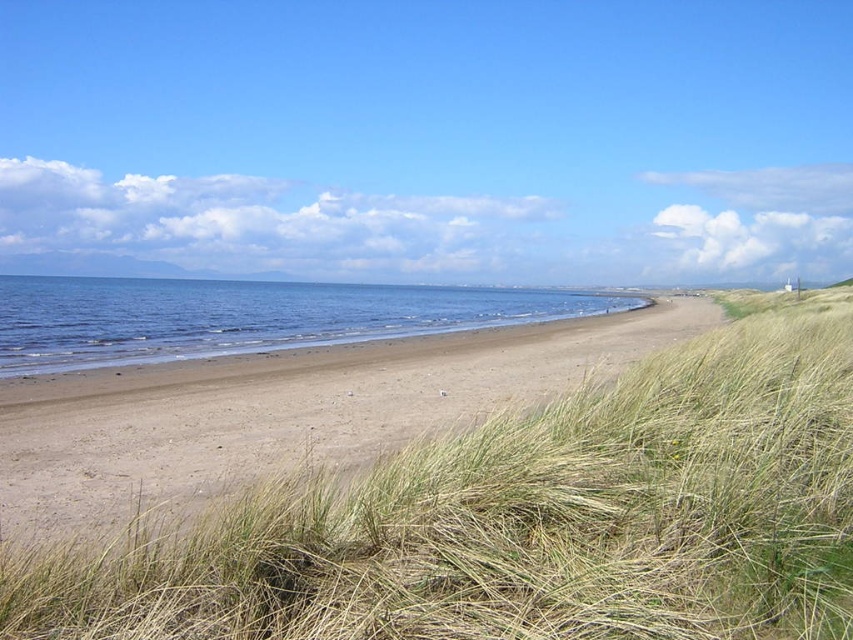
Question: Which point is farther to the camera?

Choices:
 (A) (273, 326)
 (B) (90, 502)

Answer: (A)

Question: Can you confirm if dry grass at lower left is wider than blue water at center?

Choices:
 (A) no
 (B) yes

Answer: (A)

Question: Can you confirm if dry grass at lower left is wider than blue water at center?

Choices:
 (A) yes
 (B) no

Answer: (B)

Question: Which point is closer to the camera taking this photo?

Choices:
 (A) (448, 307)
 (B) (779, 412)

Answer: (B)

Question: Which object appears closest to the camera in this image?

Choices:
 (A) blue water at center
 (B) dry grass at lower left

Answer: (B)

Question: Considering the relative positions of dry grass at lower left and blue water at center in the image provided, where is dry grass at lower left located with respect to blue water at center?

Choices:
 (A) left
 (B) right

Answer: (B)